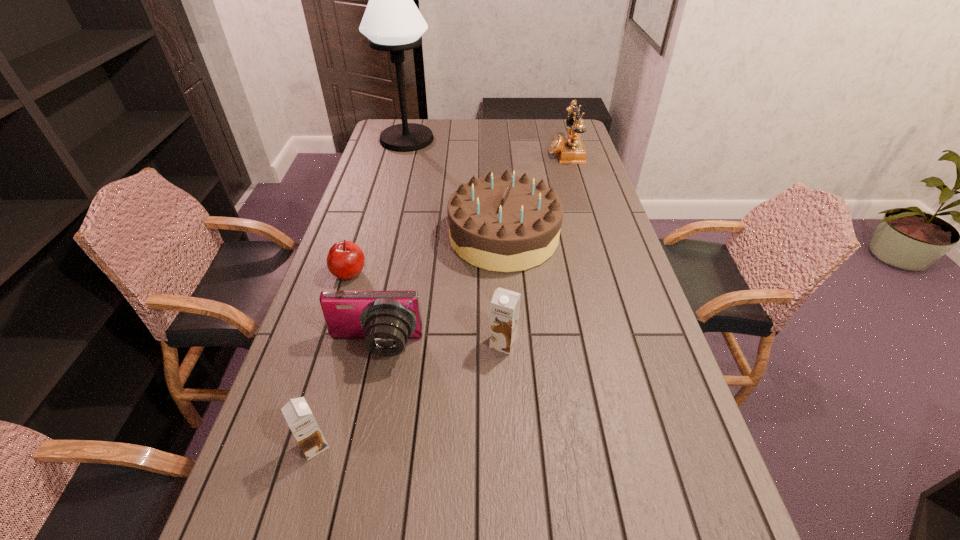
In the image, there is a desktop. Identify the location of vacant space at the near edge. (410, 488).

Where is `free space at the left edge of the desktop`? The height and width of the screenshot is (540, 960). free space at the left edge of the desktop is located at coordinates (314, 407).

Identify the location of vacant space at the right edge of the desktop. (567, 207).

This screenshot has height=540, width=960. Identify the location of vacant region between the left chocolate milk and the shortest object. (332, 359).

I want to click on vacant space that's between the birthday cake and the left chocolate milk, so click(x=409, y=341).

Find the location of a particular element. vacant region between the shortest object and the table lamp is located at coordinates (378, 206).

At what (x,y) coordinates should I click in order to perform the action: click on free space between the birthday cake and the apple. Please return your answer as a coordinate pair (x, y). This screenshot has height=540, width=960. Looking at the image, I should click on (426, 255).

The height and width of the screenshot is (540, 960). What are the coordinates of `free space between the shortest object and the tallest object` in the screenshot? It's located at (378, 206).

This screenshot has width=960, height=540. Find the location of `vacant area that lies between the apple and the shorter chocolate milk`. vacant area that lies between the apple and the shorter chocolate milk is located at coordinates (332, 359).

Locate an element on the screen. The image size is (960, 540). object that is the sixth closest to the tallest object is located at coordinates (297, 413).